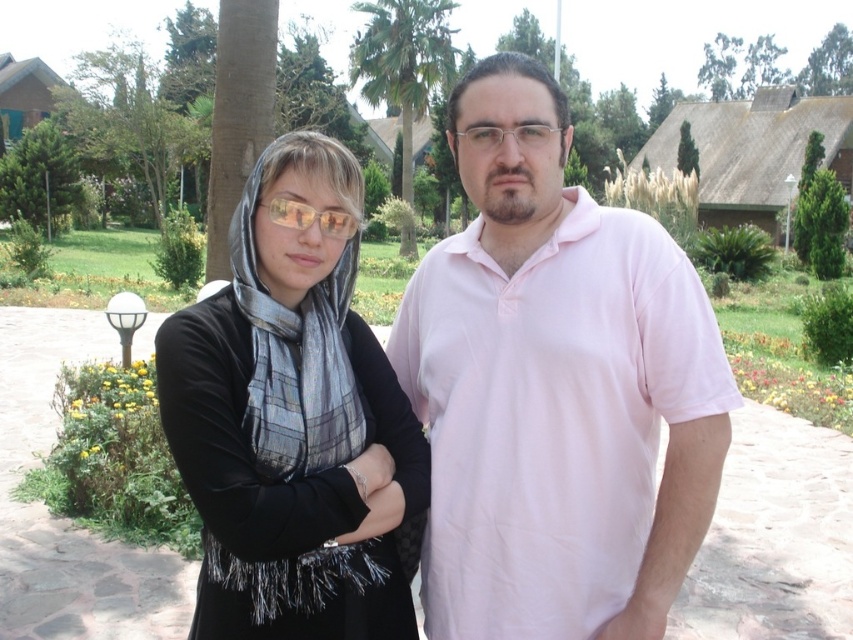
Question: Does pink cotton shirt at center appear on the right side of matte yellow lenses at center?

Choices:
 (A) yes
 (B) no

Answer: (A)

Question: Which of the following is the closest to the observer?

Choices:
 (A) (415, 44)
 (B) (186, 449)
 (C) (421, 332)
 (D) (334, 236)

Answer: (B)

Question: Is pink cotton shirt at center thinner than green leafy palm tree at center?

Choices:
 (A) no
 (B) yes

Answer: (B)

Question: Based on their relative distances, which object is nearer to the matte yellow lenses at center?

Choices:
 (A) matte black dress at center
 (B) green leafy palm tree at center

Answer: (A)

Question: Is matte black dress at center positioned before matte yellow lenses at center?

Choices:
 (A) no
 (B) yes

Answer: (B)

Question: Among these objects, which one is farthest from the camera?

Choices:
 (A) pink cotton shirt at center
 (B) matte yellow lenses at center

Answer: (B)